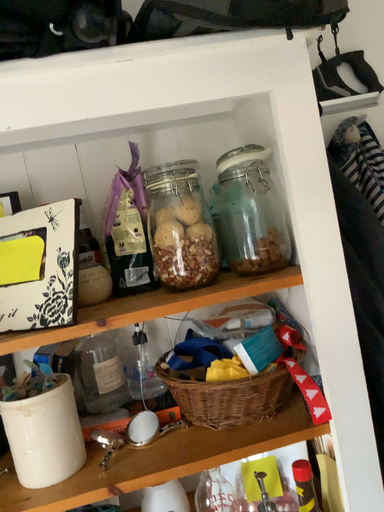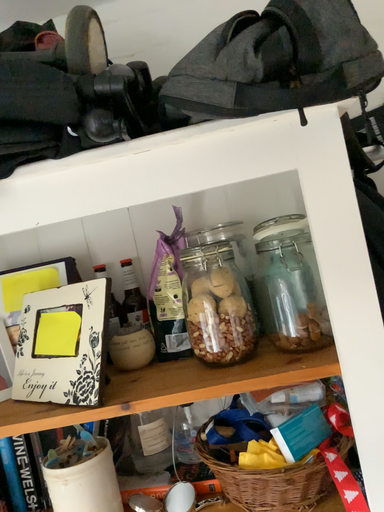
Question: How did the camera likely rotate when shooting the video?

Choices:
 (A) rotated left
 (B) rotated right

Answer: (A)